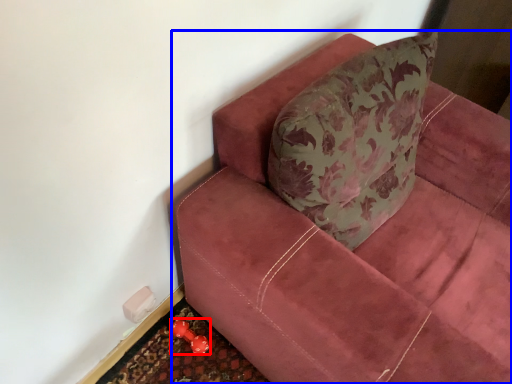
Question: Which object is further to the camera taking this photo, toy (highlighted by a red box) or studio couch (highlighted by a blue box)?

Choices:
 (A) toy
 (B) studio couch

Answer: (A)